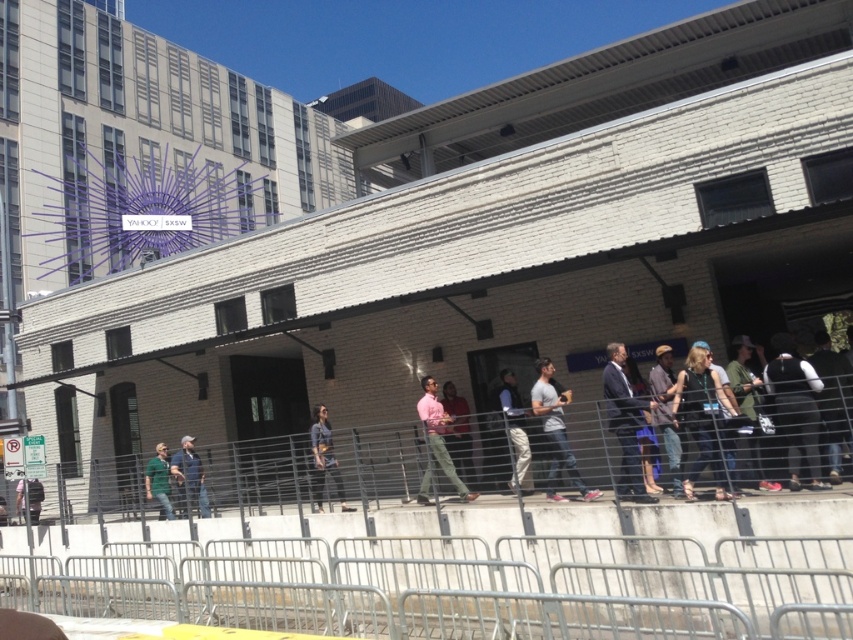
Is denim jacket at center to the right of blue denim jeans at center from the viewer's perspective?

Correct, you'll find denim jacket at center to the right of blue denim jeans at center.

Based on the photo, can you confirm if denim jacket at center is thinner than blue denim jeans at center?

Indeed, denim jacket at center has a lesser width compared to blue denim jeans at center.

From the picture: Who is more distant from viewer, (677, 394) or (209, 513)?

Point (209, 513)

Find the location of a particular element. denim jacket at center is located at coordinates (704, 420).

Locate an element on the screen. This screenshot has height=640, width=853. light gray cotton shirt at center is located at coordinates (555, 433).

Who is more forward, (541, 365) or (325, 412)?

Point (541, 365)

This screenshot has height=640, width=853. What do you see at coordinates (555, 433) in the screenshot?
I see `light gray cotton shirt at center` at bounding box center [555, 433].

Locate an element on the screen. The width and height of the screenshot is (853, 640). light gray cotton shirt at center is located at coordinates (555, 433).

The height and width of the screenshot is (640, 853). In order to click on dark gray jeans at center in this screenshot , I will do `click(323, 458)`.